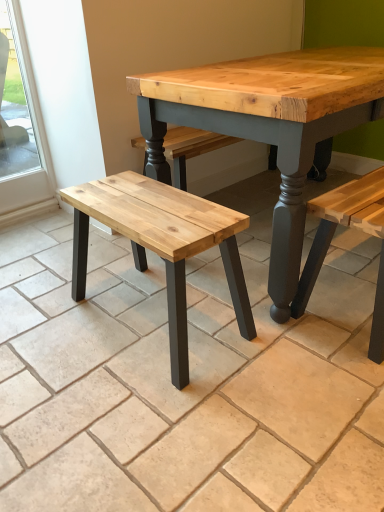
Question: From the image's perspective, would you say clear glass window at left is positioned over natural wood bench at left?

Choices:
 (A) yes
 (B) no

Answer: (A)

Question: Are clear glass window at left and natural wood bench at left far apart?

Choices:
 (A) no
 (B) yes

Answer: (B)

Question: Is the depth of clear glass window at left greater than that of natural wood bench at left?

Choices:
 (A) yes
 (B) no

Answer: (A)

Question: Is clear glass window at left positioned with its back to natural wood bench at left?

Choices:
 (A) yes
 (B) no

Answer: (B)

Question: Is clear glass window at left at the right side of natural wood bench at left?

Choices:
 (A) no
 (B) yes

Answer: (A)

Question: Can you confirm if clear glass window at left is bigger than natural wood bench at left?

Choices:
 (A) no
 (B) yes

Answer: (A)

Question: Is natural wood bench at center aimed at clear glass window at left?

Choices:
 (A) no
 (B) yes

Answer: (A)

Question: Is natural wood bench at center behind clear glass window at left?

Choices:
 (A) yes
 (B) no

Answer: (B)

Question: Are natural wood bench at center and clear glass window at left beside each other?

Choices:
 (A) yes
 (B) no

Answer: (B)

Question: Is natural wood bench at center far from clear glass window at left?

Choices:
 (A) yes
 (B) no

Answer: (A)

Question: Is natural wood bench at center not inside clear glass window at left?

Choices:
 (A) no
 (B) yes

Answer: (B)

Question: Does natural wood bench at center have a larger size compared to clear glass window at left?

Choices:
 (A) no
 (B) yes

Answer: (B)

Question: Is natural wood bench at left directly adjacent to natural wood bench at center?

Choices:
 (A) yes
 (B) no

Answer: (B)